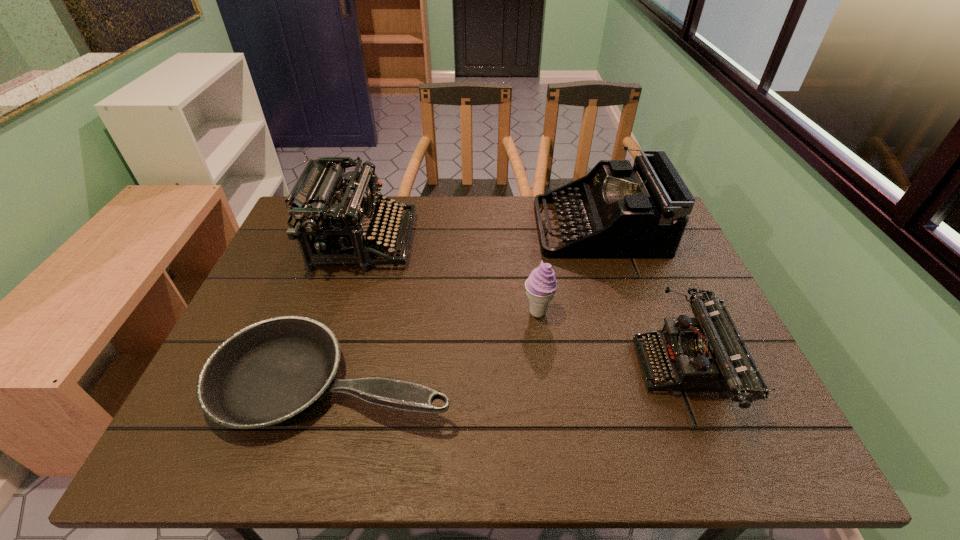
Select which object appears as the closest to the leftmost typewriter. Please provide its 2D coordinates. Your answer should be formatted as a tuple, i.e. [(x, y)], where the tuple contains the x and y coordinates of a point satisfying the conditions above.

[(271, 371)]

Identify which typewriter is the closest to the nearest typewriter. Please provide its 2D coordinates. Your answer should be formatted as a tuple, i.e. [(x, y)], where the tuple contains the x and y coordinates of a point satisfying the conditions above.

[(641, 212)]

Identify which typewriter is located as the second nearest to the leftmost typewriter. Please provide its 2D coordinates. Your answer should be formatted as a tuple, i.e. [(x, y)], where the tuple contains the x and y coordinates of a point satisfying the conditions above.

[(707, 353)]

Locate an element on the screen. vacant space that satisfies the following two spatial constraints: 1. on the typing side of the shortest object; 2. on the right side of the leftmost typewriter is located at coordinates (322, 380).

Find the location of a particular element. free space that satisfies the following two spatial constraints: 1. on the typing side of the leftmost typewriter; 2. on the left side of the icecream is located at coordinates (342, 312).